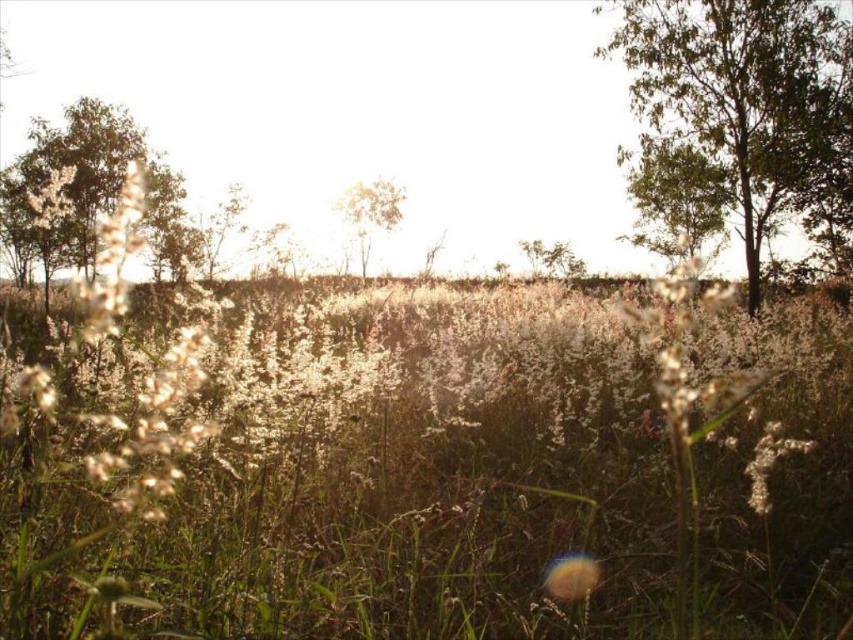
Who is higher up, brown wood tree at center or green leafy tree at center?

brown wood tree at center is above.

Can you confirm if brown wood tree at center is taller than green leafy tree at center?

Correct, brown wood tree at center is much taller as green leafy tree at center.

Which is behind, point (347, 202) or point (524, 246)?

The point (347, 202) is behind.

Where is `brown wood tree at center`? The height and width of the screenshot is (640, 853). brown wood tree at center is located at coordinates (370, 212).

Does white fluffy flower at center appear on the right side of green leafy tree at center?

Incorrect, white fluffy flower at center is not on the right side of green leafy tree at center.

Does white fluffy flower at center have a greater width compared to green leafy tree at center?

No.

Locate an element on the screen. white fluffy flower at center is located at coordinates [x=572, y=577].

The width and height of the screenshot is (853, 640). Describe the element at coordinates (741, 92) in the screenshot. I see `green leafy tree at upper right` at that location.

How much distance is there between green leafy tree at upper right and green matte tree at left?

green leafy tree at upper right is 112.31 feet away from green matte tree at left.

The height and width of the screenshot is (640, 853). What do you see at coordinates (741, 92) in the screenshot?
I see `green leafy tree at upper right` at bounding box center [741, 92].

Where is `green leafy tree at upper right`? green leafy tree at upper right is located at coordinates (741, 92).